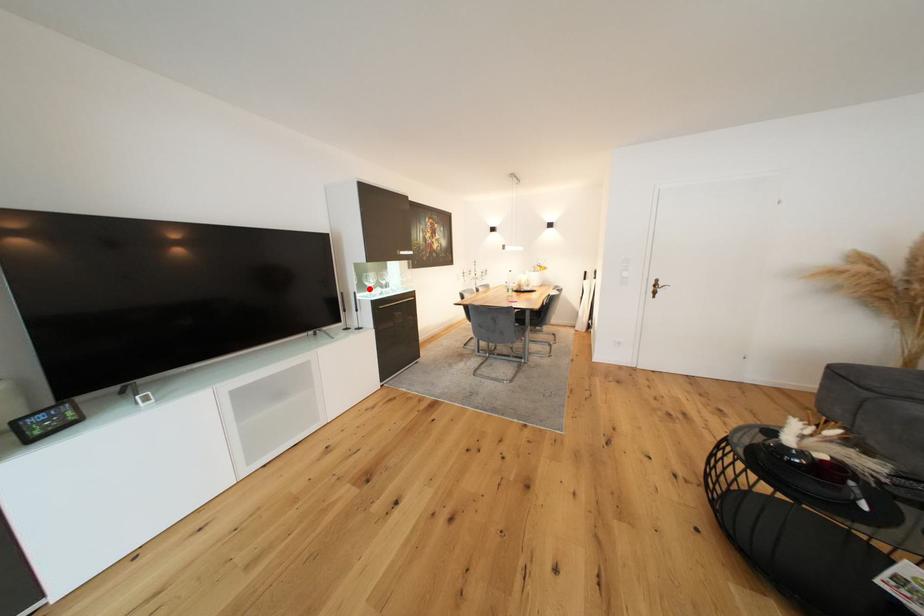
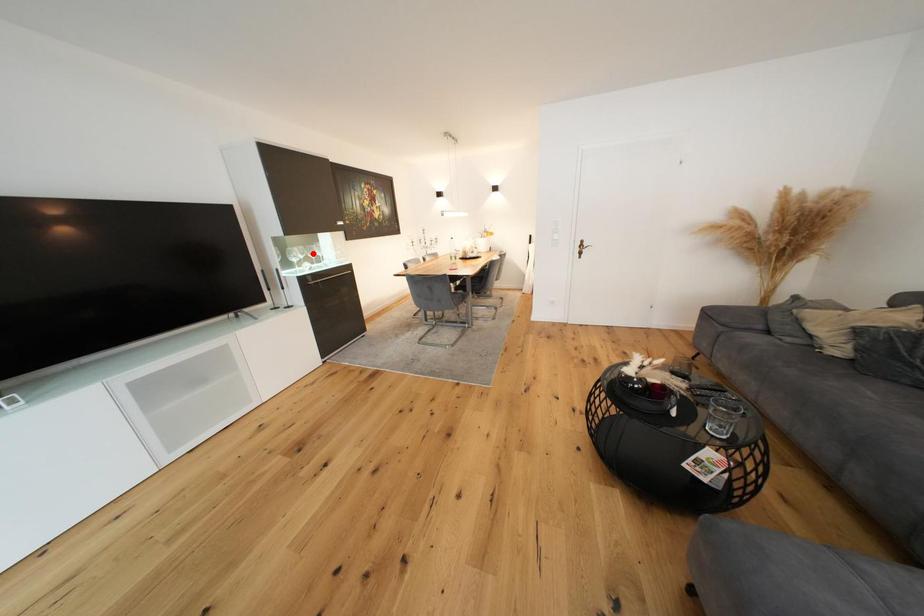
I am providing you with two images of the same scene from different viewpoints. A red point is marked on the first image and another point is marked on the second image. Is the marked point in image1 the same physical position as the marked point in image2?

No